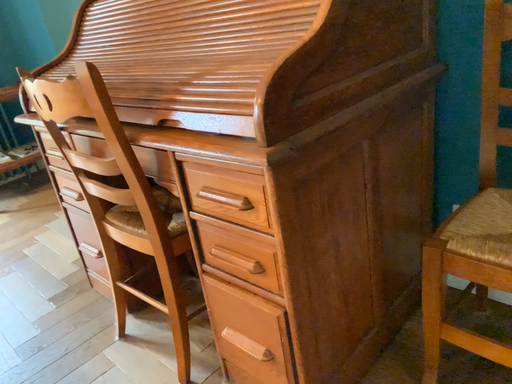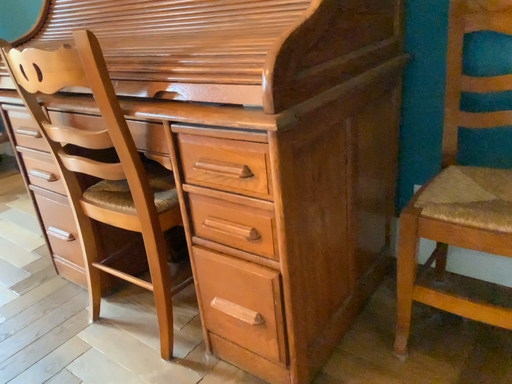
Question: Which way did the camera rotate in the video?

Choices:
 (A) rotated right
 (B) rotated left

Answer: (A)